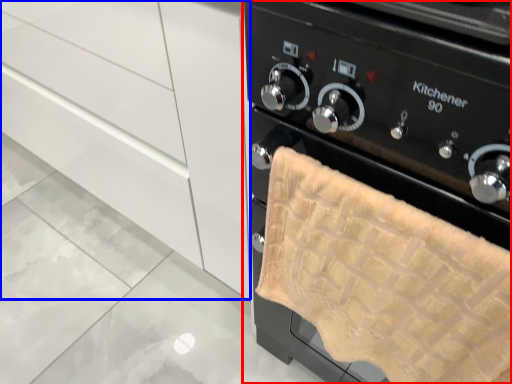
Question: Which point is further to the camera, home appliance (highlighted by a red box) or cabinetry (highlighted by a blue box)?

Choices:
 (A) home appliance
 (B) cabinetry

Answer: (B)